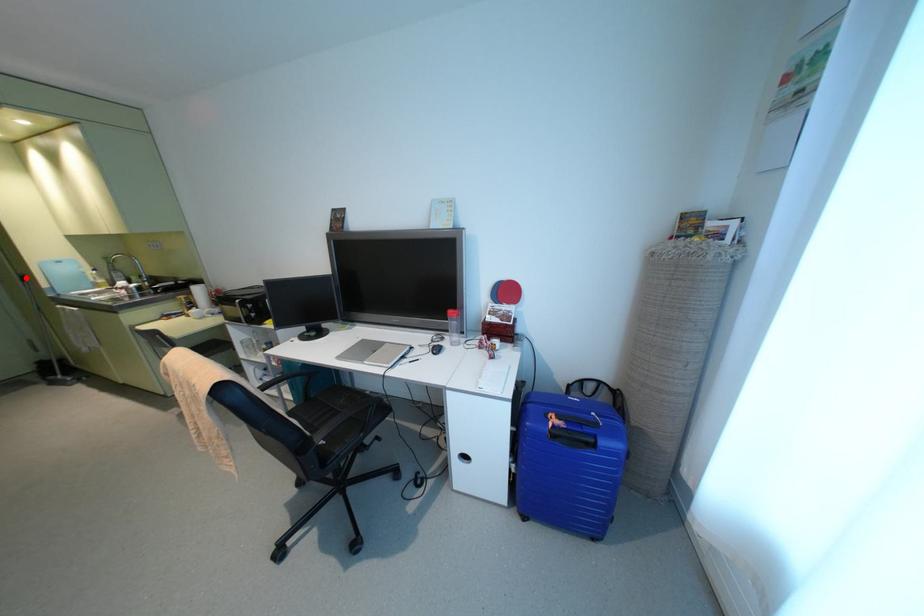
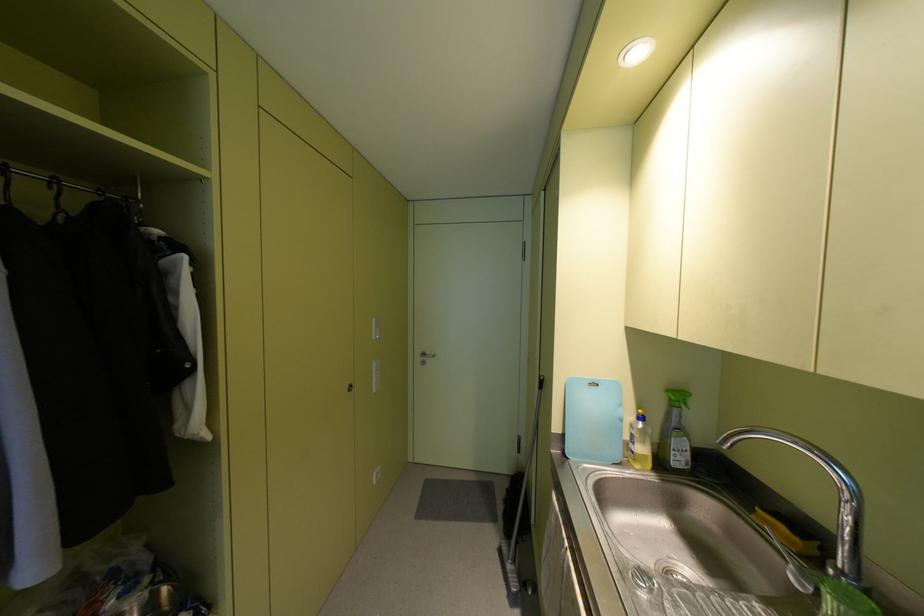
The point at the highlighted location is marked in the first image. Where is the corresponding point in the second image?

(542, 384)